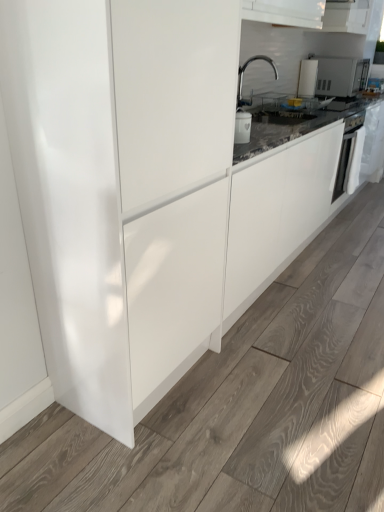
At what (x,y) coordinates should I click in order to perform the action: click on vacant area that is in front of glossy white cabinet at center. Please return your answer as a coordinate pair (x, y). Looking at the image, I should click on (123, 457).